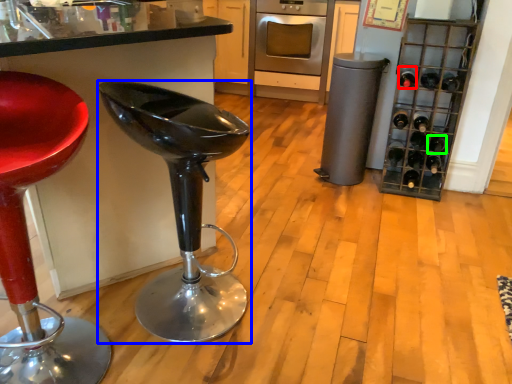
Question: Which is farther away from wine bottle (highlighted by a red box)? furniture (highlighted by a blue box) or wine bottle (highlighted by a green box)?

Choices:
 (A) furniture
 (B) wine bottle

Answer: (A)